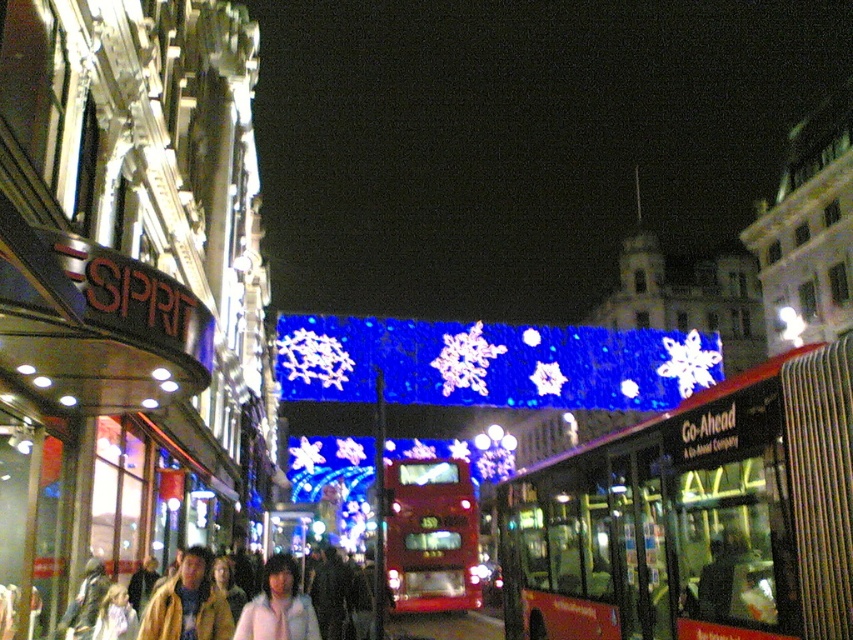
You are a pedestrian standing at the edge of the street. You see a red metallic bus at center and a leather jacket at lower left. Which object is nearer to you?

The red metallic bus at center is closer to the viewer than the leather jacket at lower left, so the red metallic bus at center is nearer to you.

From the picture: You are a pedestrian standing on the sidewalk and want to cross the street to reach the SPRIT building on the left. There are two buses in front of you, a red metallic bus at center and a shiny red bus at center. Which bus is closer to you?

Both the red metallic bus at center and the shiny red bus at center are located at the center of the image, so they are equally distant from you.